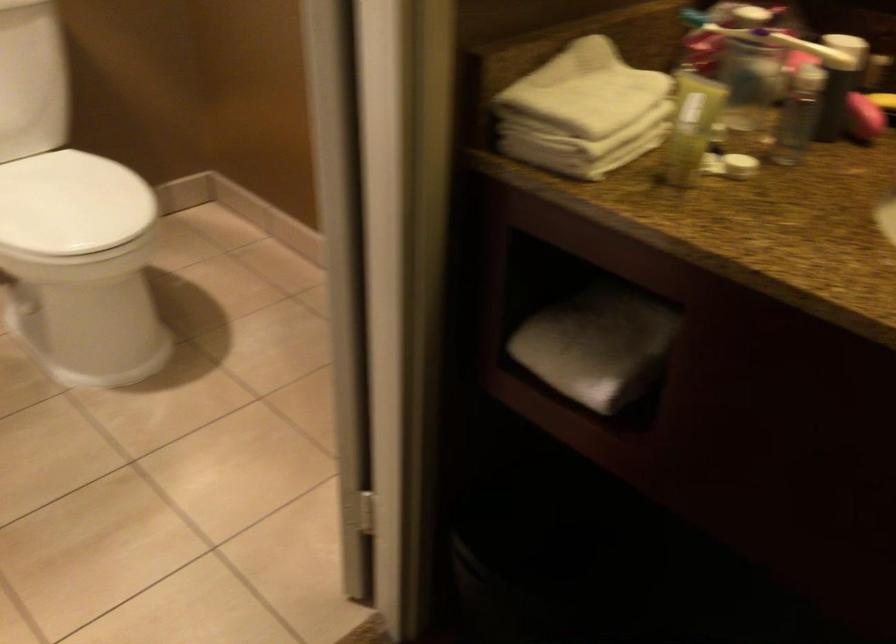
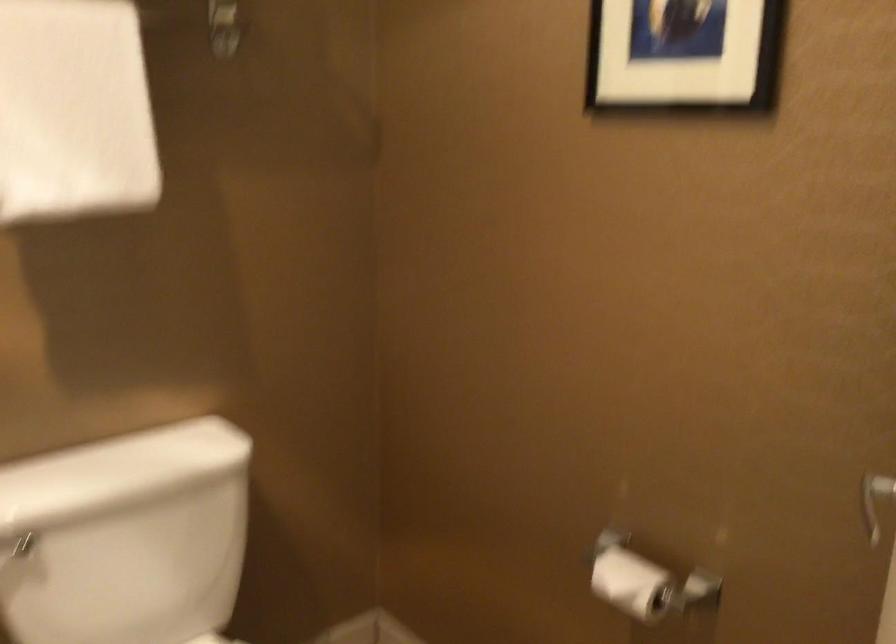
In a continuous first-person perspective shot, in which direction is the camera moving?

The movement direction of the cameraman is left, forward.